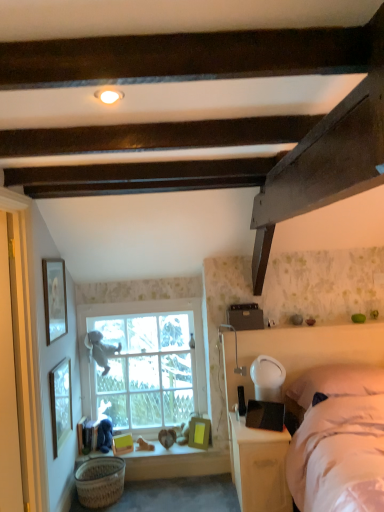
Question: Is yellow matte picture frame at lower center, which is the fourth picture frame in left-to-right order, a part of white glossy nightstand at lower right?

Choices:
 (A) yes
 (B) no

Answer: (B)

Question: Considering the relative sizes of white glossy nightstand at lower right and yellow matte picture frame at lower center, which is the fourth picture frame in left-to-right order, in the image provided, is white glossy nightstand at lower right shorter than yellow matte picture frame at lower center, which is the fourth picture frame in left-to-right order,?

Choices:
 (A) yes
 (B) no

Answer: (B)

Question: Is white glossy nightstand at lower right positioned with its back to yellow matte picture frame at lower center, the 1th picture frame when ordered from bottom to top?

Choices:
 (A) yes
 (B) no

Answer: (B)

Question: Considering the relative sizes of white glossy nightstand at lower right and yellow matte picture frame at lower center, which is the fourth picture frame in left-to-right order, in the image provided, is white glossy nightstand at lower right smaller than yellow matte picture frame at lower center, which is the fourth picture frame in left-to-right order,?

Choices:
 (A) yes
 (B) no

Answer: (B)

Question: Is white glossy nightstand at lower right completely or partially outside of yellow matte picture frame at lower center, which is the fourth picture frame in left-to-right order?

Choices:
 (A) yes
 (B) no

Answer: (A)

Question: From a real-world perspective, is white glossy nightstand at lower right physically above yellow matte picture frame at lower center, which is the fourth picture frame in left-to-right order?

Choices:
 (A) no
 (B) yes

Answer: (B)

Question: Can you confirm if gray plush toy at window, which is the second person in bottom-to-top order, is shorter than matte white picture frame at upper left, the first picture frame positioned from the left?

Choices:
 (A) yes
 (B) no

Answer: (A)

Question: Is gray plush toy at window, positioned as the first person in top-to-bottom order, further to the viewer compared to matte white picture frame at upper left, which is the fifth picture frame from right to left?

Choices:
 (A) no
 (B) yes

Answer: (B)

Question: From a real-world perspective, is gray plush toy at window, positioned as the first person in top-to-bottom order, located higher than matte white picture frame at upper left, acting as the 1th picture frame starting from the top?

Choices:
 (A) yes
 (B) no

Answer: (B)

Question: Considering the relative sizes of gray plush toy at window, which is the second person in bottom-to-top order, and matte white picture frame at upper left, which is the fifth picture frame from right to left, in the image provided, is gray plush toy at window, which is the second person in bottom-to-top order, taller than matte white picture frame at upper left, which is the fifth picture frame from right to left,?

Choices:
 (A) no
 (B) yes

Answer: (A)

Question: Does gray plush toy at window, positioned as the first person in top-to-bottom order, come in front of matte white picture frame at upper left, which is the fifth picture frame from right to left?

Choices:
 (A) yes
 (B) no

Answer: (B)

Question: Considering the relative sizes of gray plush toy at window, positioned as the first person in top-to-bottom order, and matte white picture frame at upper left, which is the fifth picture frame from right to left, in the image provided, is gray plush toy at window, positioned as the first person in top-to-bottom order, smaller than matte white picture frame at upper left, which is the fifth picture frame from right to left,?

Choices:
 (A) no
 (B) yes

Answer: (A)

Question: From a real-world perspective, is wooden picture frame at left, arranged as the 2th picture frame when viewed from the top, on top of matte gold picture frame at lower center, which is the third picture frame in bottom-to-top order?

Choices:
 (A) no
 (B) yes

Answer: (B)